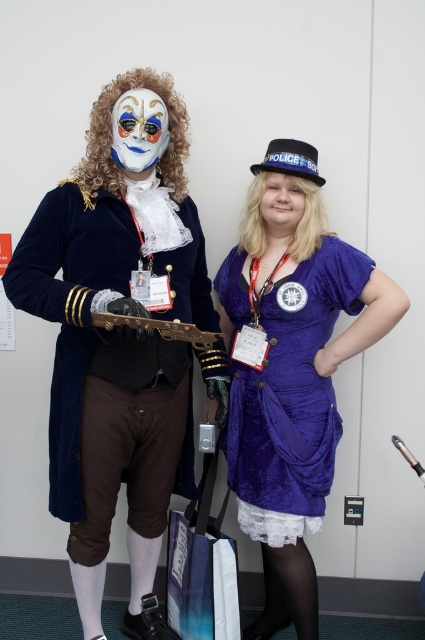
Question: Which object appears closest to the camera in this image?

Choices:
 (A) velvet purple dress at center
 (B) velvet blue coat at center

Answer: (A)

Question: Does velvet purple dress at center have a larger size compared to velvet blue coat at center?

Choices:
 (A) no
 (B) yes

Answer: (B)

Question: Is velvet purple dress at center thinner than velvet blue coat at center?

Choices:
 (A) yes
 (B) no

Answer: (B)

Question: Which point is closer to the camera?

Choices:
 (A) (289, 266)
 (B) (2, 465)

Answer: (A)

Question: Which point is closer to the camera?

Choices:
 (A) (11, 512)
 (B) (316, 186)

Answer: (B)

Question: Can you confirm if velvet purple dress at center is positioned above velvet blue coat at center?

Choices:
 (A) yes
 (B) no

Answer: (A)